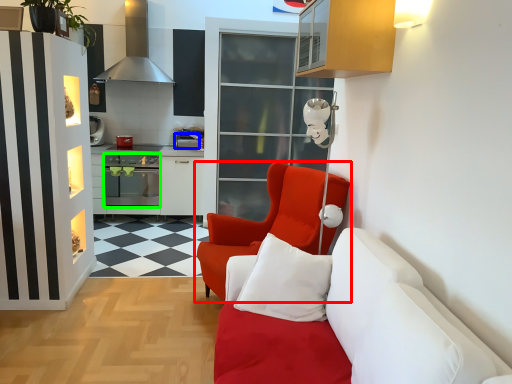
Question: Which object is the closest to the chair (highlighted by a red box)? Choose among these: appliance (highlighted by a blue box) or oven (highlighted by a green box).

Choices:
 (A) appliance
 (B) oven

Answer: (A)